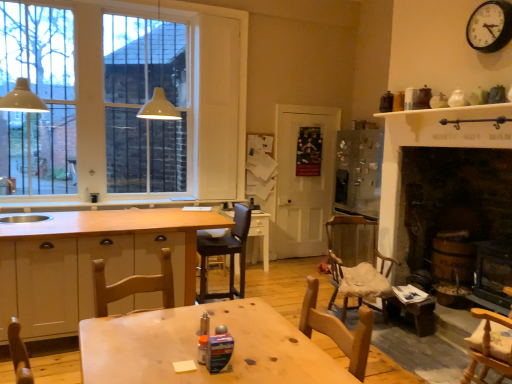
Question: Should I look upward or downward to see black metallic clock at upper right?

Choices:
 (A) down
 (B) up

Answer: (B)

Question: Does white wood cabinetry at center have a greater width compared to wooden chair at lower right, the 1th chair viewed from the right?

Choices:
 (A) no
 (B) yes

Answer: (B)

Question: Considering the relative sizes of white wood cabinetry at center and wooden chair at lower right, acting as the second chair starting from the front, in the image provided, is white wood cabinetry at center bigger than wooden chair at lower right, acting as the second chair starting from the front,?

Choices:
 (A) no
 (B) yes

Answer: (B)

Question: Considering the relative sizes of white wood cabinetry at center and wooden chair at lower right, which is counted as the fourth chair, starting from the left, in the image provided, is white wood cabinetry at center smaller than wooden chair at lower right, which is counted as the fourth chair, starting from the left,?

Choices:
 (A) yes
 (B) no

Answer: (B)

Question: From a real-world perspective, is white wood cabinetry at center located higher than wooden chair at lower right, which is counted as the fourth chair, starting from the left?

Choices:
 (A) yes
 (B) no

Answer: (B)

Question: Is white wood cabinetry at center not inside wooden chair at lower right, the 1th chair viewed from the right?

Choices:
 (A) no
 (B) yes

Answer: (B)

Question: From the image's perspective, is white wood cabinetry at center below wooden chair at lower right, which is counted as the fourth chair, starting from the left?

Choices:
 (A) yes
 (B) no

Answer: (B)

Question: Does wooden chair with cushion at center-right, the 3th chair in the left-to-right sequence, have a smaller size compared to white glossy table at center, the 2th table in the front-to-back sequence?

Choices:
 (A) no
 (B) yes

Answer: (A)

Question: Is wooden chair with cushion at center-right, the 3th chair in the left-to-right sequence, not close to white glossy table at center, the 1th table in the back-to-front sequence?

Choices:
 (A) yes
 (B) no

Answer: (A)

Question: Can you confirm if wooden chair with cushion at center-right, which ranks as the 2th chair in right-to-left order, is wider than white glossy table at center, the 1th table in the back-to-front sequence?

Choices:
 (A) yes
 (B) no

Answer: (A)

Question: Would you say wooden chair with cushion at center-right, the 3th chair in the left-to-right sequence, contains white glossy table at center, the 2th table in the front-to-back sequence?

Choices:
 (A) yes
 (B) no

Answer: (B)

Question: From the image's perspective, is wooden chair with cushion at center-right, placed as the 4th chair when sorted from front to back, above white glossy table at center, the 1th table in the back-to-front sequence?

Choices:
 (A) no
 (B) yes

Answer: (A)

Question: Are wooden chair with cushion at center-right, which ranks as the 2th chair in right-to-left order, and white glossy table at center, the 2th table in the front-to-back sequence, making contact?

Choices:
 (A) yes
 (B) no

Answer: (B)

Question: From the image's perspective, is wooden chair with cushion at center-right, which ranks as the 2th chair in right-to-left order, beneath white glass window at upper left?

Choices:
 (A) yes
 (B) no

Answer: (A)